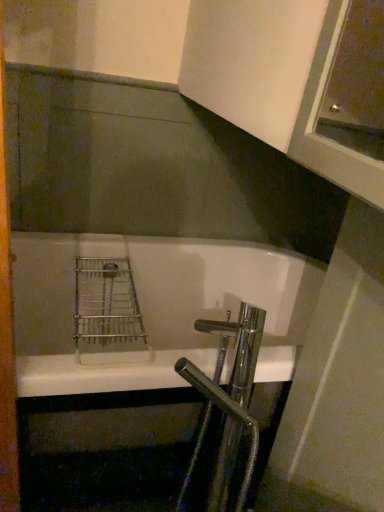
Identify the location of transparent plastic screen door at left. The height and width of the screenshot is (512, 384). (6, 333).

The height and width of the screenshot is (512, 384). What do you see at coordinates (6, 333) in the screenshot?
I see `transparent plastic screen door at left` at bounding box center [6, 333].

Find the location of a particular element. The image size is (384, 512). transparent plastic screen door at left is located at coordinates tap(6, 333).